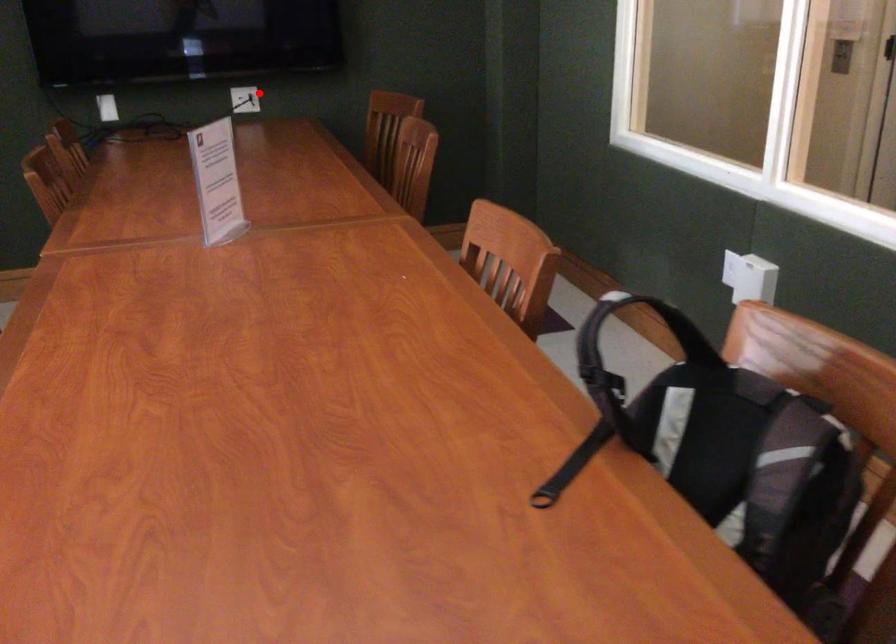
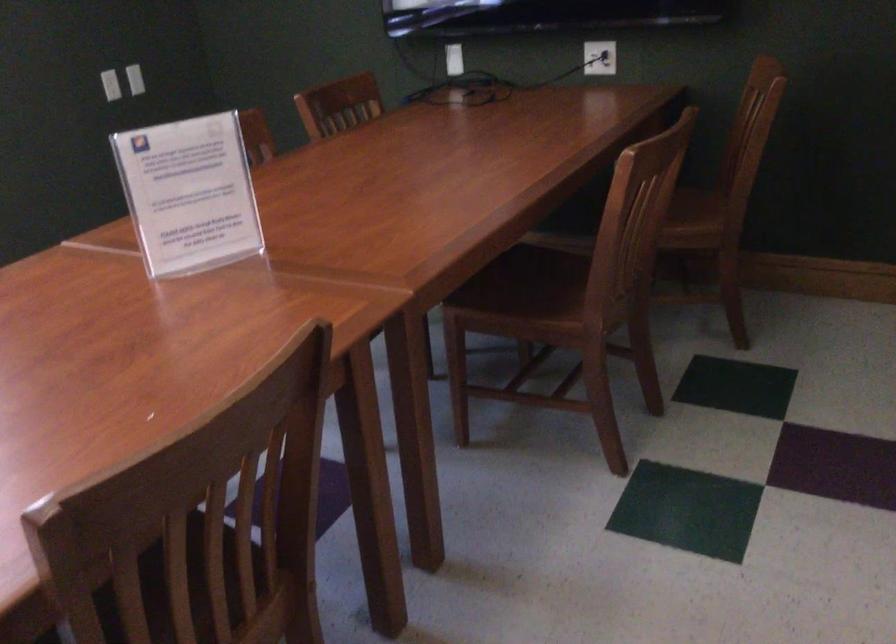
Question: I am providing you with two images of the same scene from different viewpoints. Image1 has a red point marked. In image2, the corresponding 3D location appears at what relative position? Reply with the corresponding letter.

Choices:
 (A) Closer
 (B) Farther

Answer: (A)